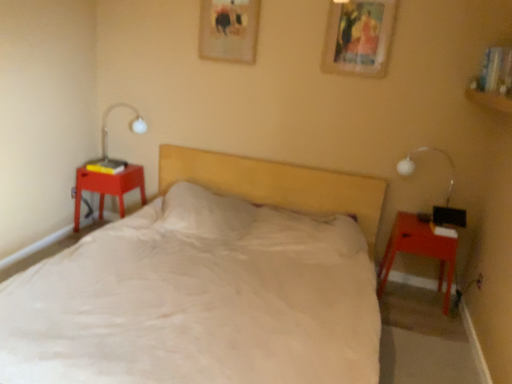
At what (x,y) coordinates should I click in order to perform the action: click on vacant space situated above matte red nightstand at right, which is counted as the 2th nightstand, starting from the back (from a real-world perspective). Please return your answer as a coordinate pair (x, y). The image size is (512, 384). Looking at the image, I should click on (420, 224).